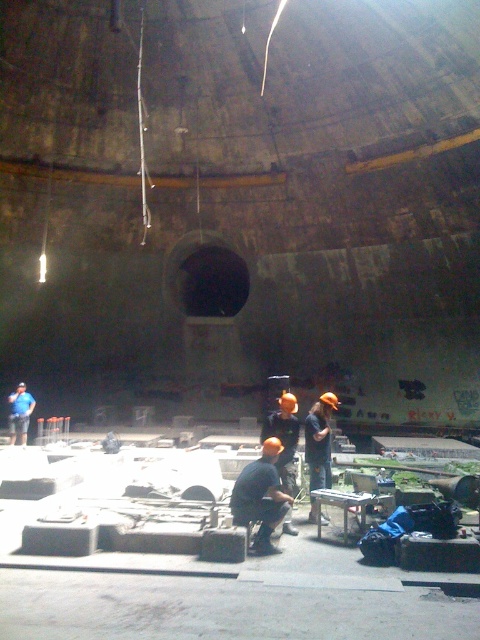
Question: Can you confirm if matte orange hard hat at center is thinner than matte blue shirt at lower left?

Choices:
 (A) no
 (B) yes

Answer: (A)

Question: Among these points, which one is farthest from the camera?

Choices:
 (A) (x=289, y=442)
 (B) (x=242, y=486)
 (C) (x=228, y=632)

Answer: (A)

Question: Which point is closer to the camera?

Choices:
 (A) matte gray concrete blocks at center
 (B) matte black shirt at center

Answer: (A)

Question: Can you confirm if matte gray concrete blocks at center is positioned above matte black shirt at center?

Choices:
 (A) no
 (B) yes

Answer: (A)

Question: Can you confirm if matte orange hard hat at center is wider than matte blue shirt at lower left?

Choices:
 (A) yes
 (B) no

Answer: (A)

Question: Which point appears farthest from the camera in this image?

Choices:
 (A) click(280, 636)
 (B) click(313, 484)
 (C) click(286, 432)
 (D) click(12, 406)

Answer: (D)